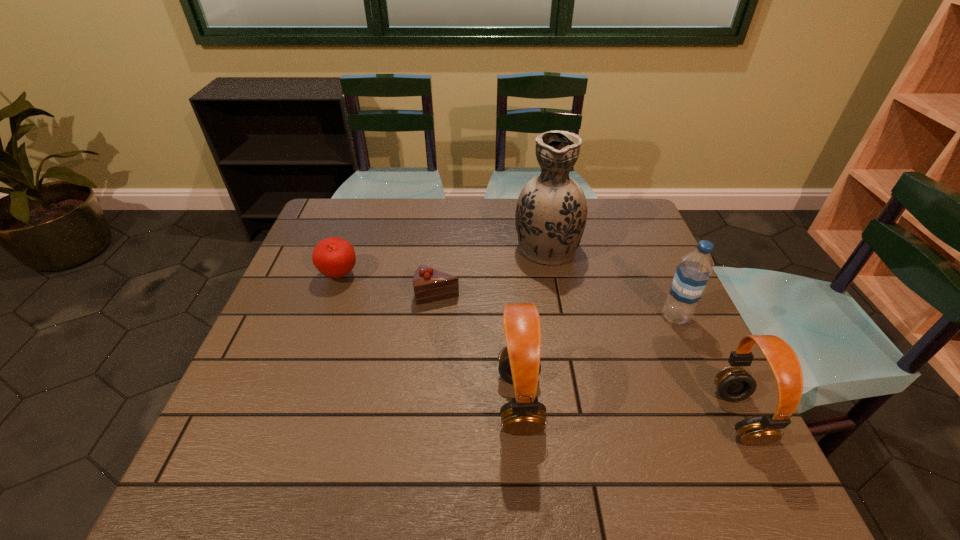
At what (x,y) coordinates should I click in order to perform the action: click on free space located 0.160m with the handle on the side of the tallest object. Please return your answer as a coordinate pair (x, y). This screenshot has height=540, width=960. Looking at the image, I should click on (538, 198).

This screenshot has height=540, width=960. In order to click on free space located 0.080m with the handle on the side of the tallest object in this screenshot , I will do `click(540, 211)`.

I want to click on vacant space situated on the label of the water bottle, so click(636, 316).

What are the coordinates of `vacant space located on the label of the water bottle` in the screenshot? It's located at (582, 316).

Find the location of a particular element. This screenshot has width=960, height=540. vacant region located 0.170m on the label of the water bottle is located at coordinates (593, 316).

What are the coordinates of `vacant area situated 0.260m on the back of the chocolate cake` in the screenshot? It's located at (444, 227).

The image size is (960, 540). I want to click on vacant space located 0.270m on the back of the apple, so click(x=363, y=211).

Find the location of a particular element. object at the far edge is located at coordinates (551, 212).

Where is `object that is at the left edge`? object that is at the left edge is located at coordinates (334, 257).

Find the location of a particular element. headset situated at the right edge is located at coordinates (734, 384).